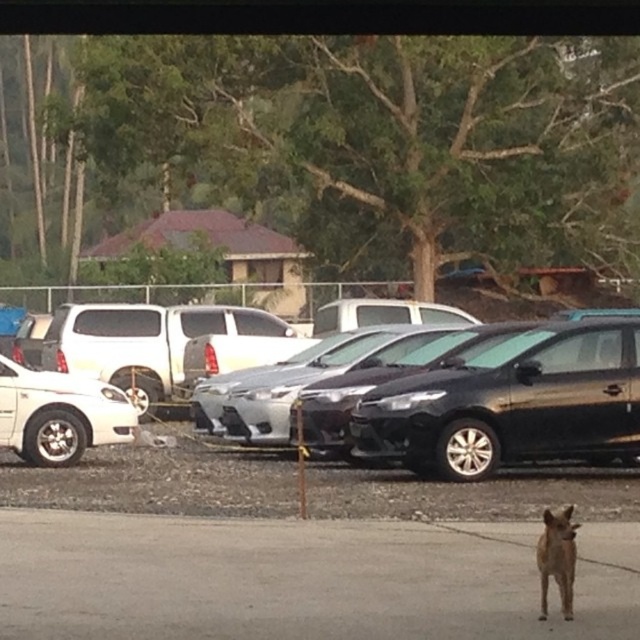
You are standing at the center of the parking lot and want to find the white matte sedan at left. According to the coordinates provided, where should you look relative to your position?

The white matte sedan at left is located at coordinates (60,413), which means it is positioned to the left and slightly forward from your central position in the parking lot.

You are a delivery person trying to reach the satin black sedan at center parked behind the brown fur dog at lower center. Can you drive your delivery cart through the space between them?

The brown fur dog at lower center is below the satin black sedan at center, so there is no vertical space between them for the delivery cart to pass through. You will need to move the dog or find an alternative route.

You are a delivery person who needs to place a package on the ground near the brown fur dog at lower center. According to the image, where exactly should you place the package in terms of coordinates?

The package should be placed at the coordinates corresponding to the position of the brown fur dog at lower center, which is at point (300, 579).